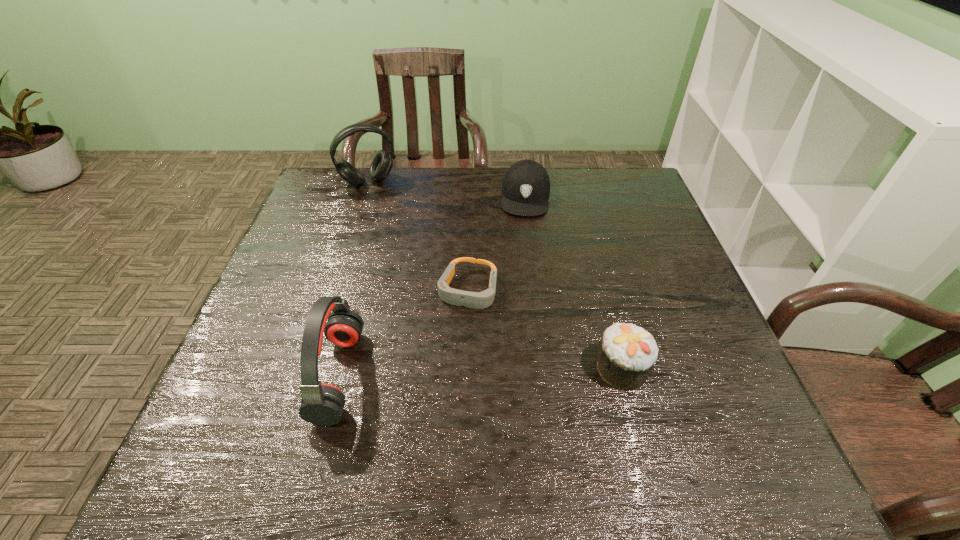
Identify the location of cupcake situated at the near edge. The width and height of the screenshot is (960, 540). coord(627,353).

This screenshot has height=540, width=960. In order to click on object that is at the left edge in this screenshot , I will do `click(382, 163)`.

Locate an element on the screen. The width and height of the screenshot is (960, 540). object at the far left corner is located at coordinates (382, 163).

Locate an element on the screen. free location at the far edge of the desktop is located at coordinates (567, 184).

Find the location of a particular element. vacant space at the near edge of the desktop is located at coordinates (623, 395).

At what (x,y) coordinates should I click in order to perform the action: click on vacant space at the left edge. Please return your answer as a coordinate pair (x, y). This screenshot has width=960, height=540. Looking at the image, I should click on (300, 349).

Where is `vacant space at the right edge of the desktop`? Image resolution: width=960 pixels, height=540 pixels. vacant space at the right edge of the desktop is located at coordinates (636, 272).

This screenshot has width=960, height=540. I want to click on free space at the far left corner of the desktop, so click(x=324, y=176).

What are the coordinates of `vacant space at the near right corner` in the screenshot? It's located at (706, 415).

Find the location of a particular element. Image resolution: width=960 pixels, height=540 pixels. unoccupied area between the shortest object and the headset is located at coordinates (418, 237).